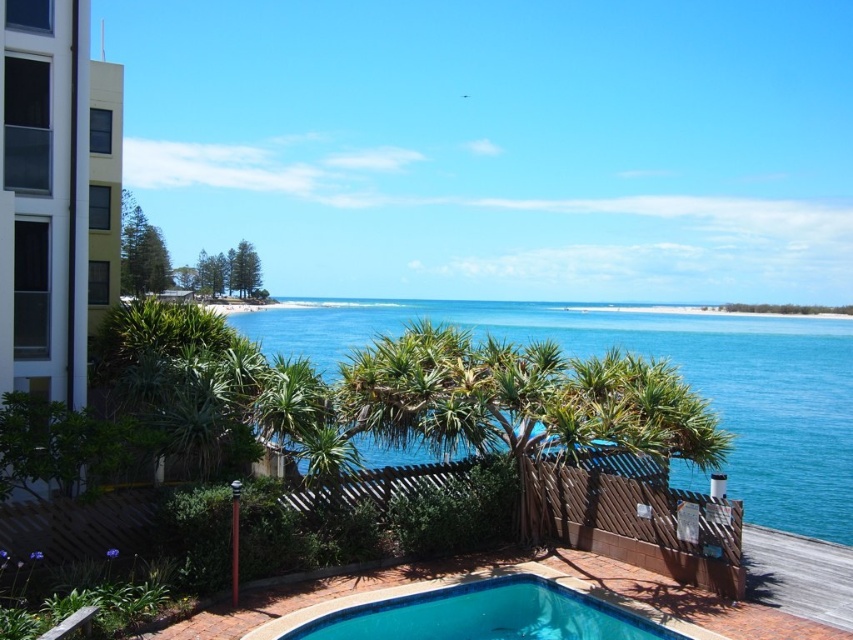
Measure the distance from blue water at center to blue tile swimming pool at lower center.

blue water at center is 42.90 meters from blue tile swimming pool at lower center.

Does blue water at center have a greater height compared to blue tile swimming pool at lower center?

Indeed, blue water at center has a greater height compared to blue tile swimming pool at lower center.

Is point (701, 392) in front of point (566, 604)?

No.

Find the location of a particular element. This screenshot has height=640, width=853. blue water at center is located at coordinates coord(656,356).

Is blue water at center above white glass building at left?

Incorrect, blue water at center is not positioned above white glass building at left.

Does blue water at center lie in front of white glass building at left?

That is False.

Is point (848, 502) farther from viewer compared to point (94, 115)?

Yes, it is behind point (94, 115).

You are a GUI agent. You are given a task and a screenshot of the screen. Output one action in this format:
    pyautogui.click(x=<x>, y=<y>)
    Task: Click on the blue water at center
    
    Given the screenshot: What is the action you would take?
    pyautogui.click(x=656, y=356)

Can you confirm if white glass building at left is thinner than blue tile swimming pool at lower center?

Correct, white glass building at left's width is less than blue tile swimming pool at lower center's.

Between white glass building at left and blue tile swimming pool at lower center, which one has less height?

Standing shorter between the two is blue tile swimming pool at lower center.

Who is more distant from viewer, (67, 269) or (514, 627)?

The point (67, 269) is behind.

The height and width of the screenshot is (640, 853). I want to click on white glass building at left, so click(54, 195).